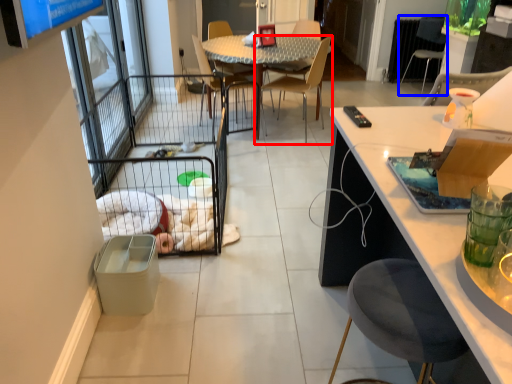
Question: Which point is further to the camera, chair (highlighted by a red box) or chair (highlighted by a blue box)?

Choices:
 (A) chair
 (B) chair

Answer: (B)